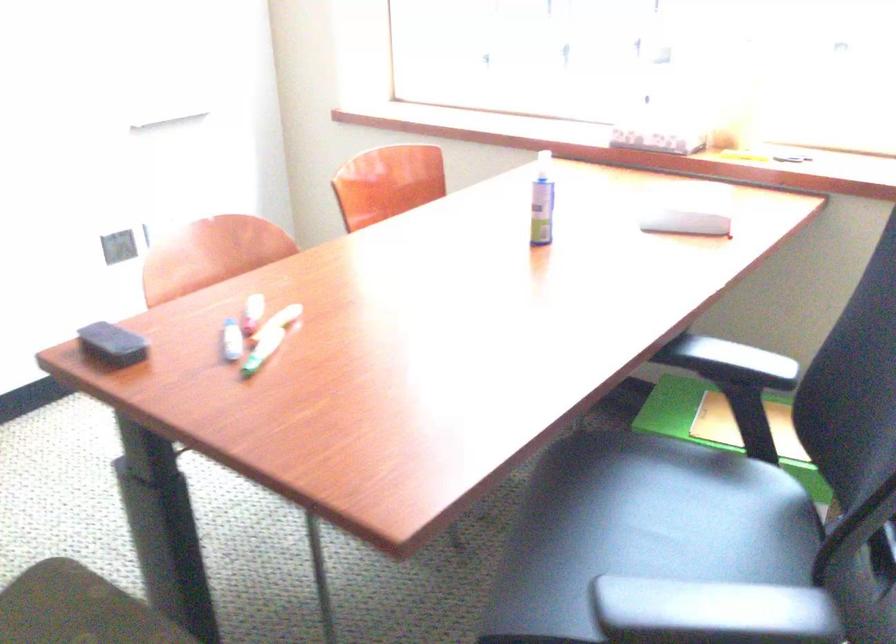
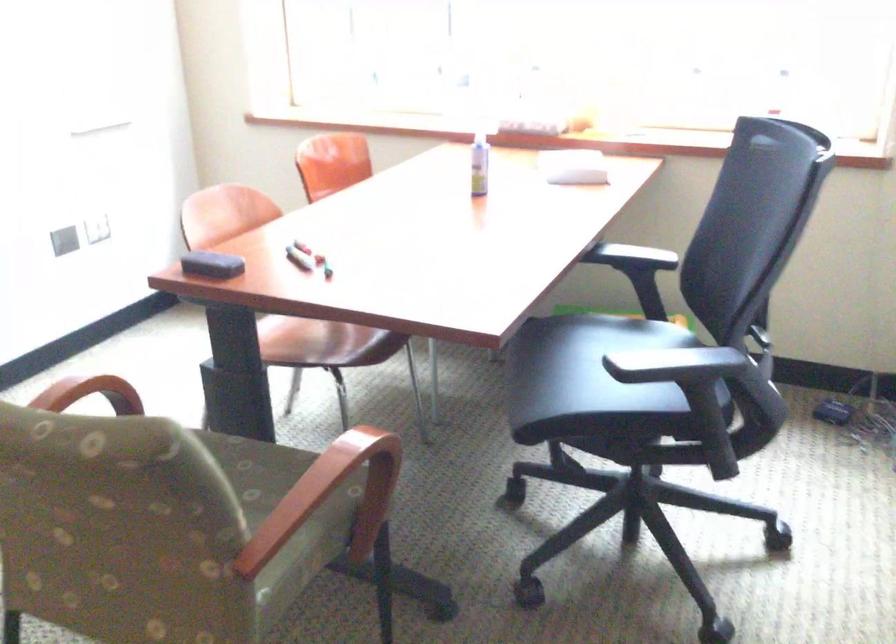
In the second image, find the point that corresponds to pixel 632 520 in the first image.

(591, 361)